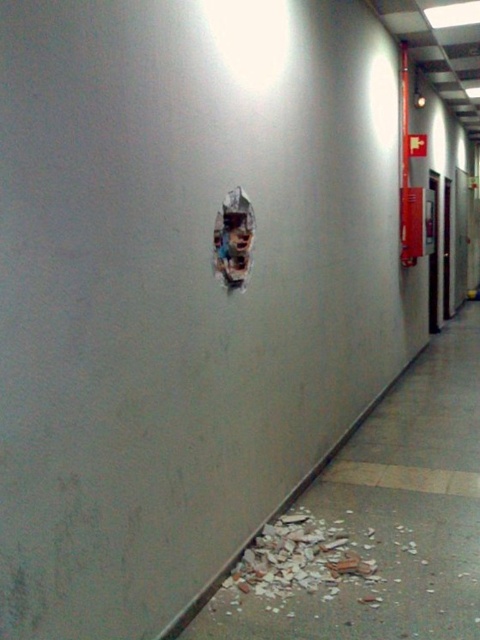
You are navigating a corridor and see two points marked on the wall. The first point is at coordinates point (x=229, y=580) and the second point is at point (x=218, y=228). Which point is closer to you as you face the wall?

Point (x=218, y=228) is closer to you because it is less further to the camera than point (x=229, y=580).

You are a maintenance worker in the corridor. You see the crumbly concrete debris at lower center and the ripped paper at center. Which object is closer to you?

The crumbly concrete debris at lower center is closer to you because it is in front of the ripped paper at center.